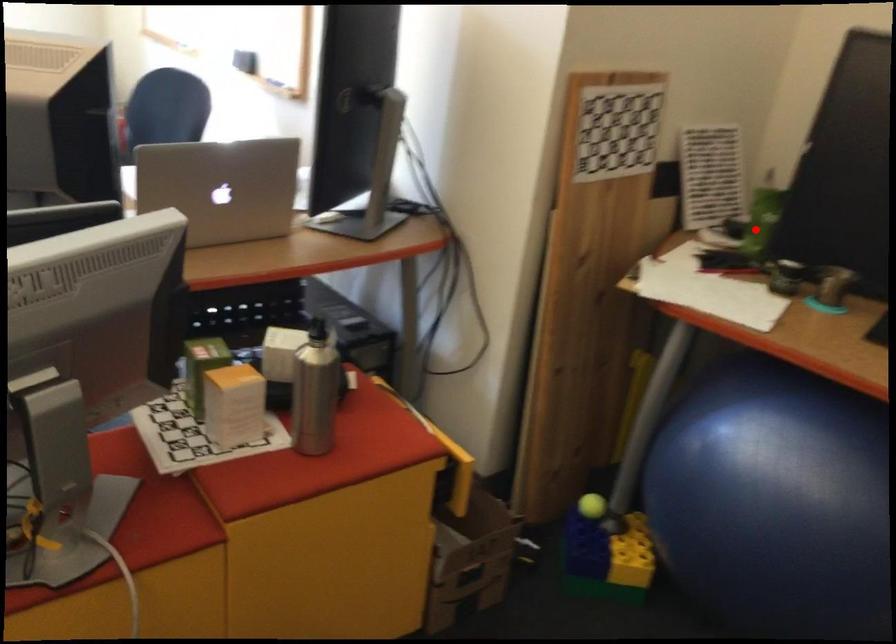
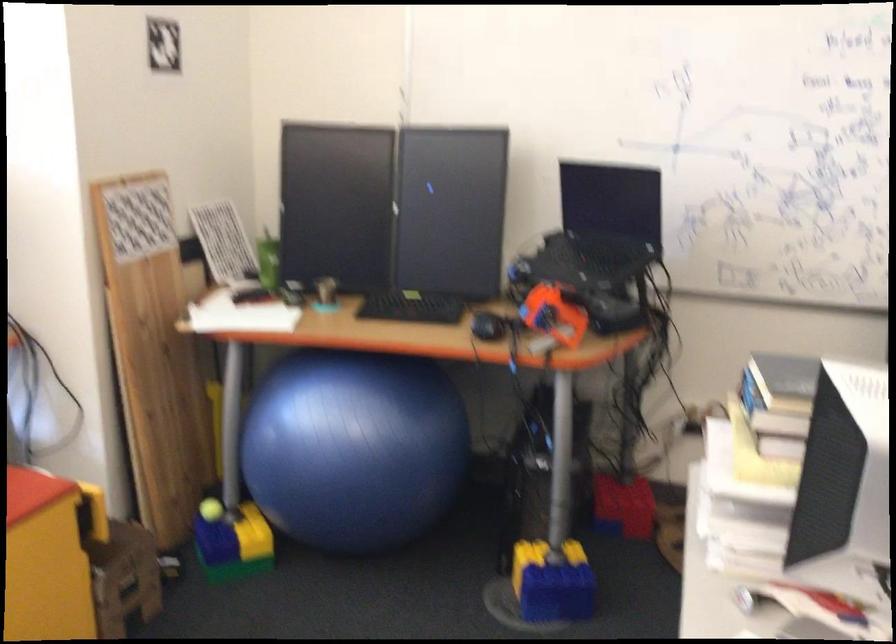
Question: I am providing you with two images of the same scene from different viewpoints. In image1, a red point is highlighted. Considering the same 3D point in image2, which of the following is correct?

Choices:
 (A) It is closer
 (B) It is farther

Answer: (B)